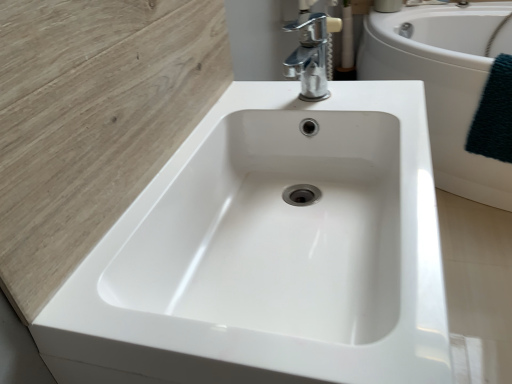
Find the location of a particular element. This screenshot has height=384, width=512. vacant area that lies to the right of chrome metallic faucet at upper center is located at coordinates (374, 98).